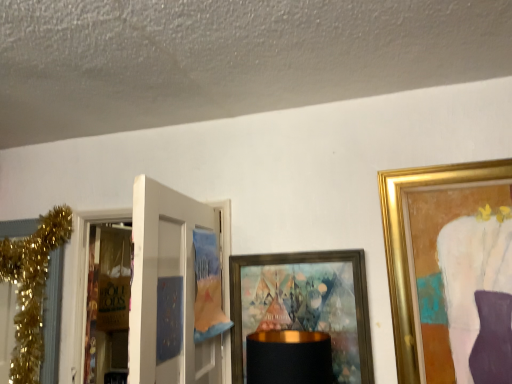
Locate an element on the screen. gold-framed artwork at center is located at coordinates (304, 305).

The height and width of the screenshot is (384, 512). Find the location of `gold glitter garland at left`. gold glitter garland at left is located at coordinates (32, 288).

The image size is (512, 384). What are the coordinates of `brown paper bag at left` in the screenshot? It's located at (106, 299).

Is brown paper bag at left oriented towards gold-framed artwork at center?

No, brown paper bag at left is not facing towards gold-framed artwork at center.

Would you consider brown paper bag at left to be distant from gold-framed artwork at center?

That's right, there is a large distance between brown paper bag at left and gold-framed artwork at center.

How different are the orientations of brown paper bag at left and gold-framed artwork at center in degrees?

The facing directions of brown paper bag at left and gold-framed artwork at center are 0.378 degrees apart.

From the image's perspective, between brown paper bag at left and gold-framed artwork at center, who is located below?

gold-framed artwork at center.

Consider the image. Is brown paper bag at left not near gold glitter garland at left?

That's right, there is a large distance between brown paper bag at left and gold glitter garland at left.

Who is more distant, brown paper bag at left or gold glitter garland at left?

brown paper bag at left is more distant.

Based on their sizes in the image, would you say brown paper bag at left is bigger or smaller than gold glitter garland at left?

brown paper bag at left is smaller than gold glitter garland at left.

Does gold-framed artwork at center turn towards gold glitter garland at left?

No, gold-framed artwork at center is not turned towards gold glitter garland at left.

From a real-world perspective, is gold-framed artwork at center physically located above or below gold glitter garland at left?

gold-framed artwork at center is situated lower than gold glitter garland at left in the real world.

Is gold-framed artwork at center next to gold glitter garland at left and touching it?

No, gold-framed artwork at center is not in contact with gold glitter garland at left.

Is gold-framed artwork at center in front of gold glitter garland at left?

Yes, gold-framed artwork at center is in front of gold glitter garland at left.

Considering the relative positions of gold glitter garland at left and white matte door at left in the image provided, is gold glitter garland at left behind white matte door at left?

Yes, gold glitter garland at left is behind white matte door at left.

Consider the image. Would you consider gold glitter garland at left to be distant from white matte door at left?

Actually, gold glitter garland at left and white matte door at left are a little close together.

Does gold glitter garland at left turn towards white matte door at left?

No, gold glitter garland at left is not turned towards white matte door at left.

From a real-world perspective, which object stands above the other?

From a 3D spatial view, gold glitter garland at left is above.

From the image's perspective, is white matte door at left under brown paper bag at left?

No, from the image's perspective, white matte door at left is not below brown paper bag at left.

Is white matte door at left situated inside brown paper bag at left or outside?

white matte door at left is located beyond the bounds of brown paper bag at left.

From a real-world perspective, between white matte door at left and brown paper bag at left, who is vertically lower?

In real-world perspective, brown paper bag at left is lower.

Could you tell me if white matte door at left is turned towards brown paper bag at left?

Yes.

Considering the relative positions of white matte door at left and gold-framed artwork at center in the image provided, is white matte door at left behind gold-framed artwork at center?

No, white matte door at left is closer to the camera.

Find the location of a particular element. The width and height of the screenshot is (512, 384). door that is in front of the gold-framed artwork at center is located at coordinates (170, 276).

Which object is positioned more to the left, white matte door at left or gold-framed artwork at center?

Positioned to the left is white matte door at left.

From the picture: From a real-world perspective, is white matte door at left below gold-framed artwork at center?

No, from a real-world perspective, white matte door at left is not beneath gold-framed artwork at center.

Image resolution: width=512 pixels, height=384 pixels. Identify the location of screen door located on the right of gold glitter garland at left. (106, 299).

Who is smaller, gold glitter garland at left or brown paper bag at left?

Smaller between the two is brown paper bag at left.

Based on the photo, between gold glitter garland at left and brown paper bag at left, which one is positioned in front?

gold glitter garland at left is more forward.

Can you tell me how much gold glitter garland at left and brown paper bag at left differ in facing direction?

There is a 0.536-degree angle between the facing directions of gold glitter garland at left and brown paper bag at left.

Identify the location of picture frame lying on the right of brown paper bag at left. The width and height of the screenshot is (512, 384). (304, 305).

Find the location of `christmas decoration in front of the brown paper bag at left`. christmas decoration in front of the brown paper bag at left is located at coordinates (32, 288).

When comparing their distances from white matte door at left, does gold glitter garland at left or brown paper bag at left seem closer?

gold glitter garland at left.

When comparing their distances from gold-framed artwork at center, does brown paper bag at left or gold glitter garland at left seem closer?

Based on the image, gold glitter garland at left appears to be nearer to gold-framed artwork at center.

Considering their positions, is brown paper bag at left positioned further to white matte door at left than gold-framed artwork at center?

brown paper bag at left.

Estimate the real-world distances between objects in this image. Which object is further from white matte door at left, gold-framed artwork at center or gold glitter garland at left?

gold glitter garland at left lies further to white matte door at left than the other object.

When comparing their distances from gold-framed artwork at center, does brown paper bag at left or white matte door at left seem further?

brown paper bag at left is positioned further to the anchor gold-framed artwork at center.

From the image, which object appears to be nearer to white matte door at left, gold-framed artwork at center or brown paper bag at left?

gold-framed artwork at center is closer to white matte door at left.

Which object lies nearer to the anchor point gold glitter garland at left, gold-framed artwork at center or white matte door at left?

white matte door at left.

Looking at the image, which one is located further to gold-framed artwork at center, white matte door at left or brown paper bag at left?

The object further to gold-framed artwork at center is brown paper bag at left.

You are a GUI agent. You are given a task and a screenshot of the screen. Output one action in this format:
    pyautogui.click(x=<x>, y=<y>)
    Task: Click on the screen door located between gold glitter garland at left and white matte door at left in the left-right direction
    This screenshot has width=512, height=384.
    Given the screenshot: What is the action you would take?
    pyautogui.click(x=106, y=299)

Where is `door situated between brown paper bag at left and gold-framed artwork at center from left to right`? The height and width of the screenshot is (384, 512). door situated between brown paper bag at left and gold-framed artwork at center from left to right is located at coordinates (170, 276).

Find the location of a particular element. screen door between gold glitter garland at left and gold-framed artwork at center from left to right is located at coordinates (106, 299).

You are a GUI agent. You are given a task and a screenshot of the screen. Output one action in this format:
    pyautogui.click(x=<x>, y=<y>)
    Task: Click on the door situated between gold glitter garland at left and gold-framed artwork at center from left to right
    
    Given the screenshot: What is the action you would take?
    pos(170,276)